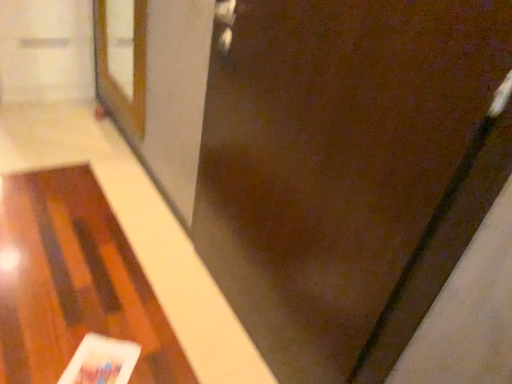
This screenshot has height=384, width=512. I want to click on free spot above white glossy magazine at lower left (from a real-world perspective), so click(x=102, y=366).